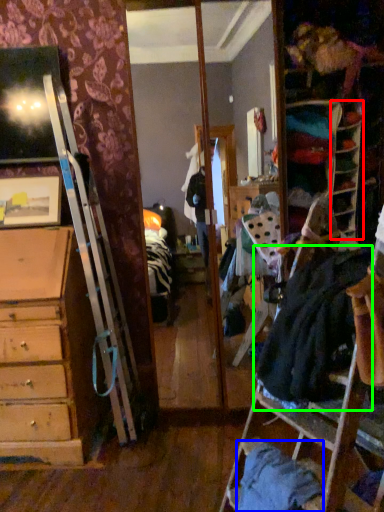
Question: Which object is the closest to the shelf (highlighted by a red box)? Choose among these: clothing (highlighted by a blue box) or clothing (highlighted by a green box).

Choices:
 (A) clothing
 (B) clothing

Answer: (B)